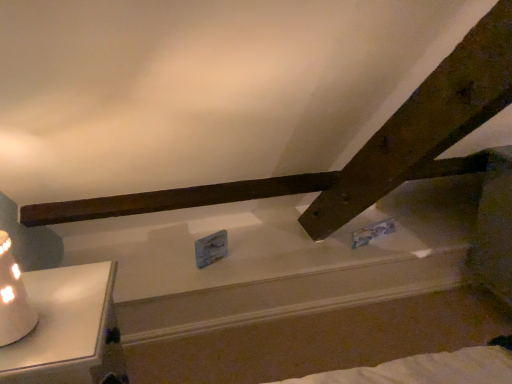
This screenshot has width=512, height=384. I want to click on free spot above white glossy candlestick at lower left (from a real-world perspective), so click(x=61, y=311).